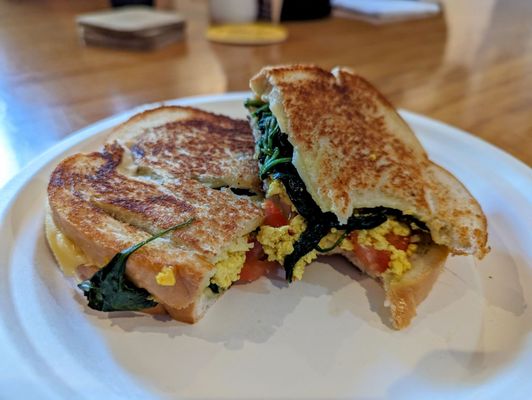
You are a GUI agent. You are given a task and a screenshot of the screen. Output one action in this format:
    pyautogui.click(x=<x>, y=<y>)
    Task: Click on the plate
    This screenshot has height=400, width=532.
    Given the screenshot: What is the action you would take?
    pyautogui.click(x=242, y=355)